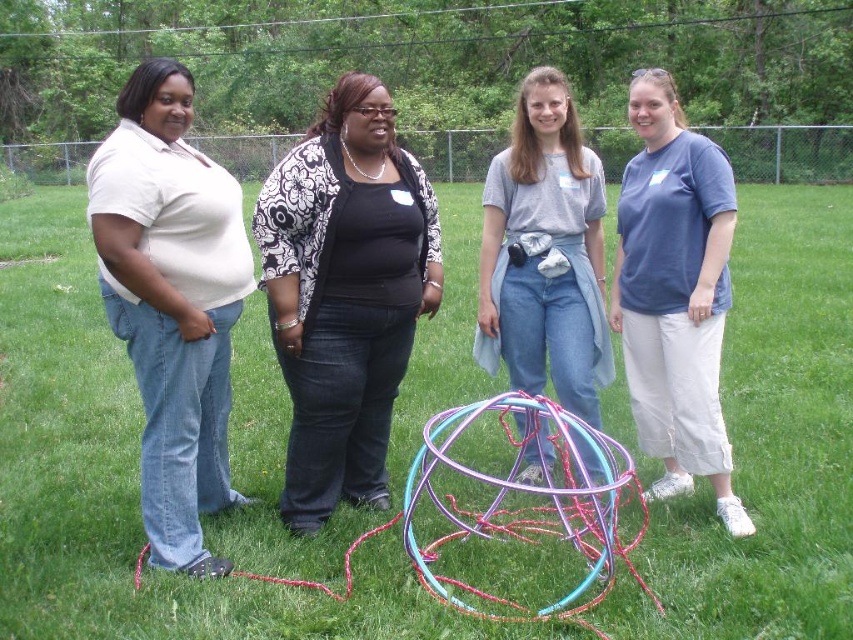
Between point (329, 429) and point (663, 348), which one is positioned behind?

Point (663, 348)

Identify the location of black matte/black textured shirt at center. This screenshot has height=640, width=853. (344, 292).

Between metallic wire ball at center and black matte/black textured shirt at center, which one appears on the right side from the viewer's perspective?

black matte/black textured shirt at center

Can you confirm if metallic wire ball at center is positioned above black matte/black textured shirt at center?

Yes.

I want to click on metallic wire ball at center, so pos(131,481).

Is matte white shirt at left below blue cotton shirt at right?

Yes.

From the picture: Does matte white shirt at left have a lesser width compared to blue cotton shirt at right?

Incorrect, matte white shirt at left's width is not less than blue cotton shirt at right's.

Describe the element at coordinates (171, 301) in the screenshot. The width and height of the screenshot is (853, 640). I see `matte white shirt at left` at that location.

Locate an element on the screen. This screenshot has width=853, height=640. matte white shirt at left is located at coordinates (171, 301).